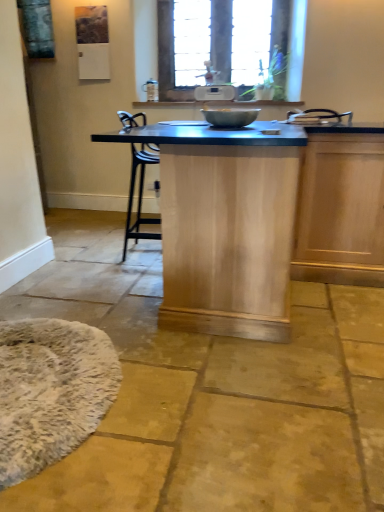
Identify the location of free space that is in between white fluffy mat at lower left and natural wood table at center. (144, 356).